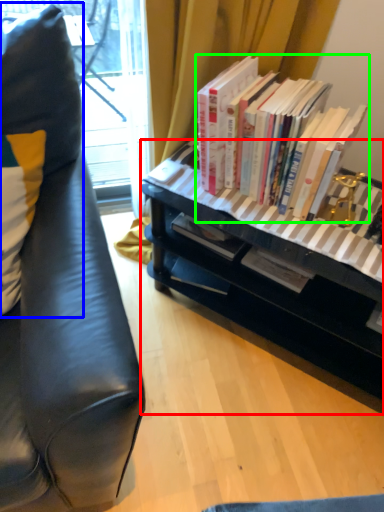
Question: Based on their relative distances, which object is farther from desk (highlighted by a red box)? Choose from pillow (highlighted by a blue box) and book (highlighted by a green box).

Choices:
 (A) pillow
 (B) book

Answer: (A)